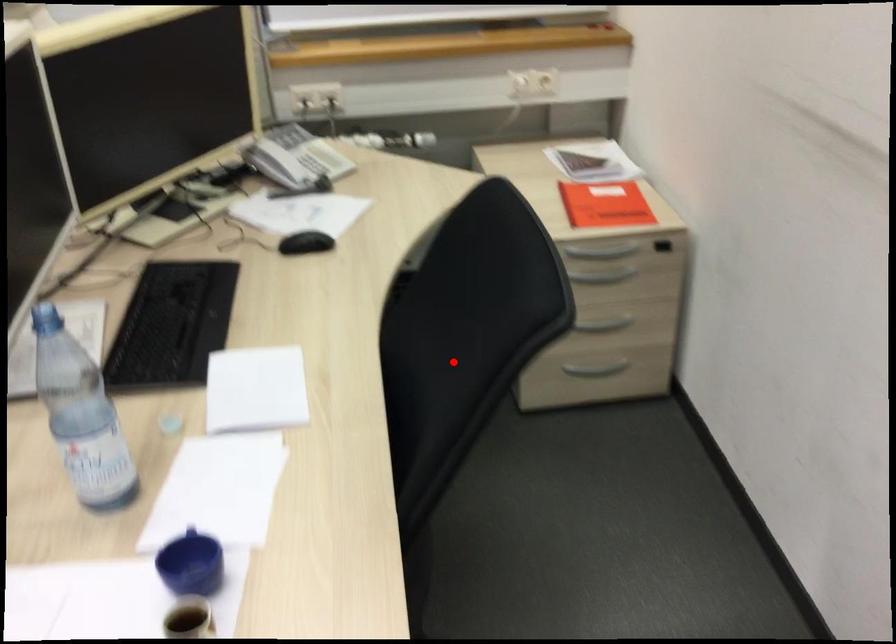
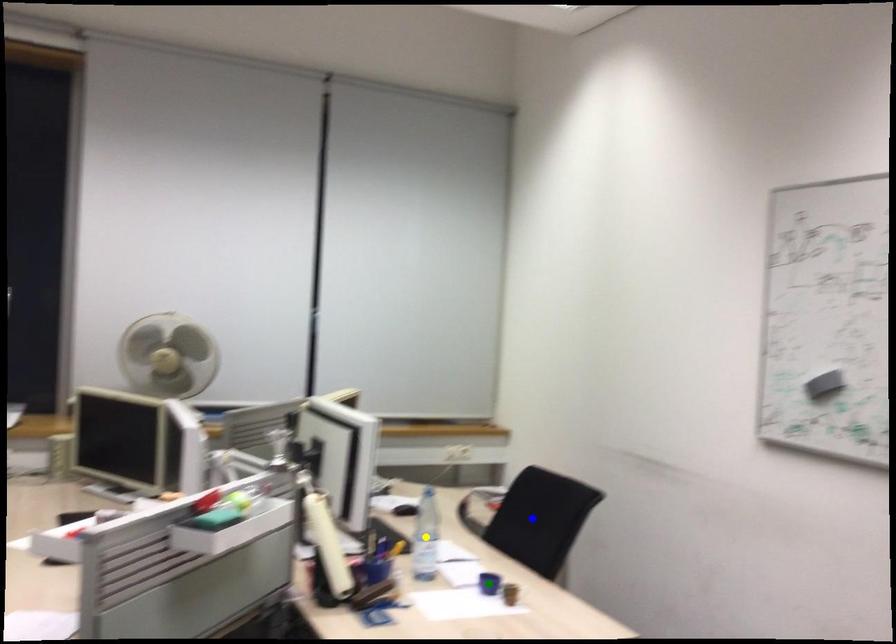
Question: I am providing you with two images of the same scene from different viewpoints. A red point is marked on the first image. You are given multiple points on the second image. In image 2, which mark is for the same physical point as the one in image 1?

Choices:
 (A) yellow point
 (B) blue point
 (C) green point

Answer: (B)